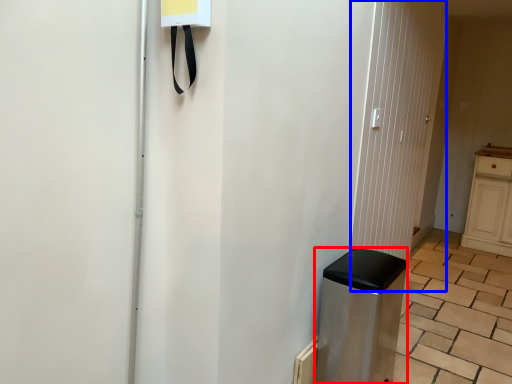
Question: Which object is further to the camera taking this photo, appliance (highlighted by a red box) or screen door (highlighted by a blue box)?

Choices:
 (A) appliance
 (B) screen door

Answer: (B)